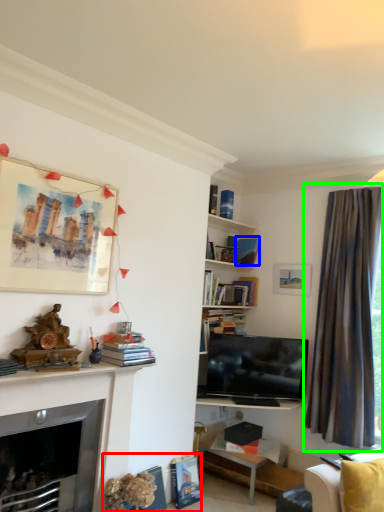
Question: Which is nearer to the book (highlighted by a red box)? book (highlighted by a blue box) or curtain (highlighted by a green box).

Choices:
 (A) book
 (B) curtain

Answer: (B)